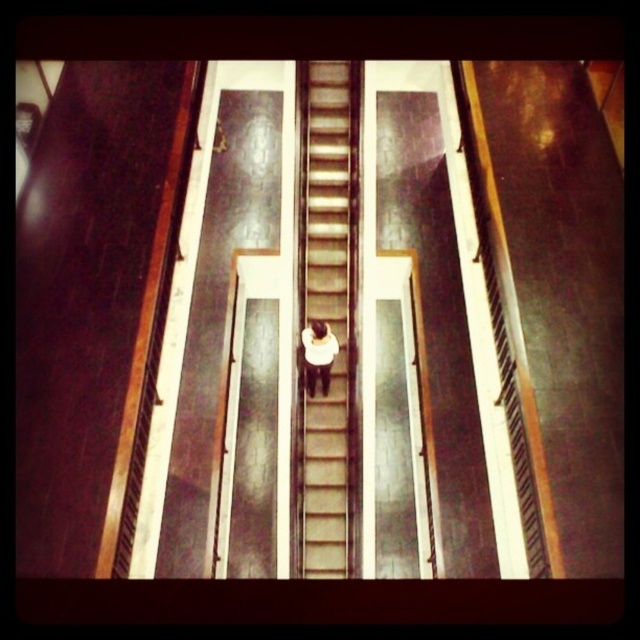
Question: Which point is closer to the camera?

Choices:
 (A) (x=332, y=360)
 (B) (x=342, y=403)

Answer: (A)

Question: Can you confirm if smooth concrete stairs at center is thinner than white matte shirt at center?

Choices:
 (A) yes
 (B) no

Answer: (B)

Question: Which of the following is the farthest from the observer?

Choices:
 (A) (323, 360)
 (B) (349, 172)

Answer: (B)

Question: Does smooth concrete stairs at center appear on the left side of white matte shirt at center?

Choices:
 (A) no
 (B) yes

Answer: (A)

Question: Which object appears farthest from the camera in this image?

Choices:
 (A) smooth concrete stairs at center
 (B) white matte shirt at center

Answer: (B)

Question: Can you confirm if smooth concrete stairs at center is positioned to the left of white matte shirt at center?

Choices:
 (A) no
 (B) yes

Answer: (A)